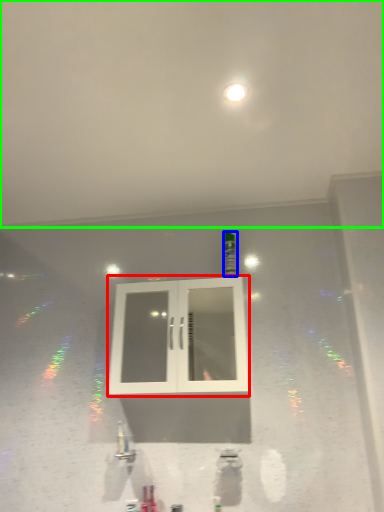
Question: Which object is positioned closest to window (highlighted by a red box)? Select from bottle (highlighted by a blue box) and backdrop (highlighted by a green box).

Choices:
 (A) bottle
 (B) backdrop

Answer: (A)